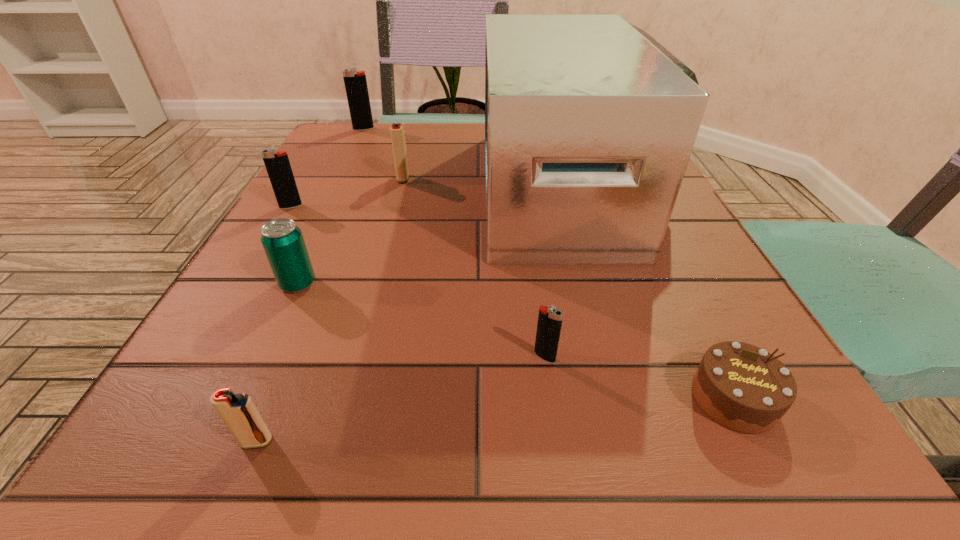
You are a GUI agent. You are given a task and a screenshot of the screen. Output one action in this format:
    pyautogui.click(x=<x>, y=<y>)
    Task: Click on the free space located on the right of the leftmost black igniter
    The width and height of the screenshot is (960, 540).
    Given the screenshot: What is the action you would take?
    pyautogui.click(x=400, y=206)

Image resolution: width=960 pixels, height=540 pixels. What are the coordinates of `free space located 0.050m on the right of the fourth nearest igniter` in the screenshot? It's located at (433, 178).

You are a GUI agent. You are given a task and a screenshot of the screen. Output one action in this format:
    pyautogui.click(x=<x>, y=<y>)
    Task: Click on the vacant space situated on the back of the fourth nearest object
    
    Given the screenshot: What is the action you would take?
    tap(337, 200)

Where is `free space located on the back of the nearest igniter`? free space located on the back of the nearest igniter is located at coordinates (319, 288).

Identify the location of vacant space located 0.250m on the left of the rightmost black igniter. (342, 357).

Find the location of a particular element. This screenshot has width=960, height=540. free region located on the left of the shortest object is located at coordinates (525, 398).

This screenshot has height=540, width=960. Identify the location of microwave oven present at the far edge. (590, 122).

At what (x,y) coordinates should I click in order to perform the action: click on igniter present at the far edge. Please return your answer as a coordinate pair (x, y). This screenshot has height=540, width=960. Looking at the image, I should click on (356, 87).

This screenshot has width=960, height=540. In order to click on igniter that is positioned at the near edge in this screenshot , I will do `click(239, 413)`.

The image size is (960, 540). Identify the location of chocolate cake present at the near edge. (742, 387).